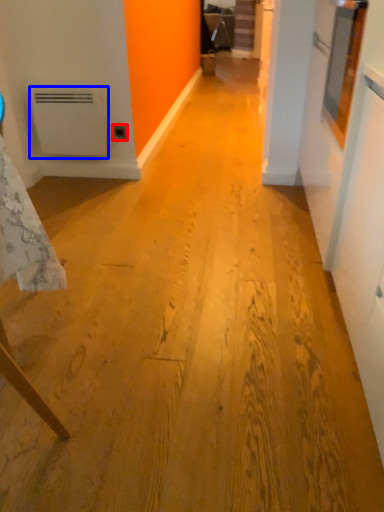
Question: Which of the following is the farthest to the observer, electric outlet (highlighted by a red box) or water heater (highlighted by a blue box)?

Choices:
 (A) electric outlet
 (B) water heater

Answer: (A)